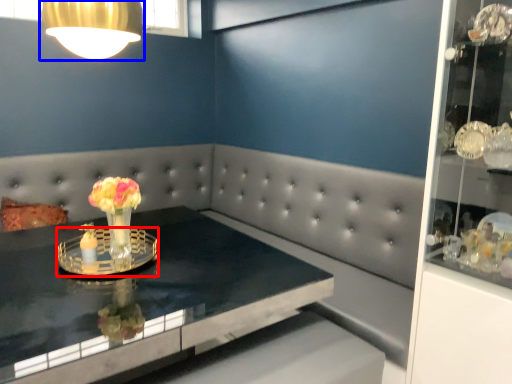
Question: Which object appears closest to the camera in this image, glass plate (highlighted by a red box) or lamp (highlighted by a blue box)?

Choices:
 (A) glass plate
 (B) lamp

Answer: (B)